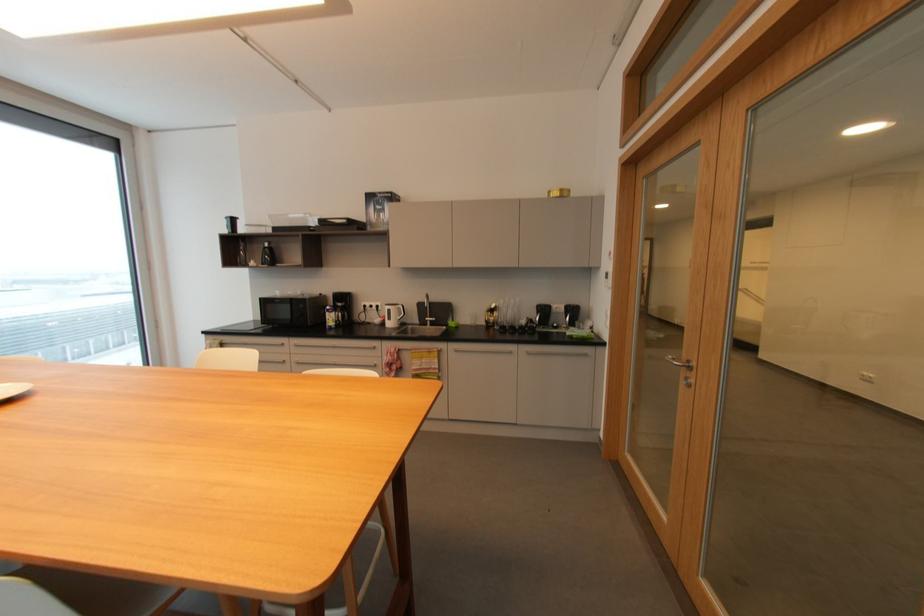
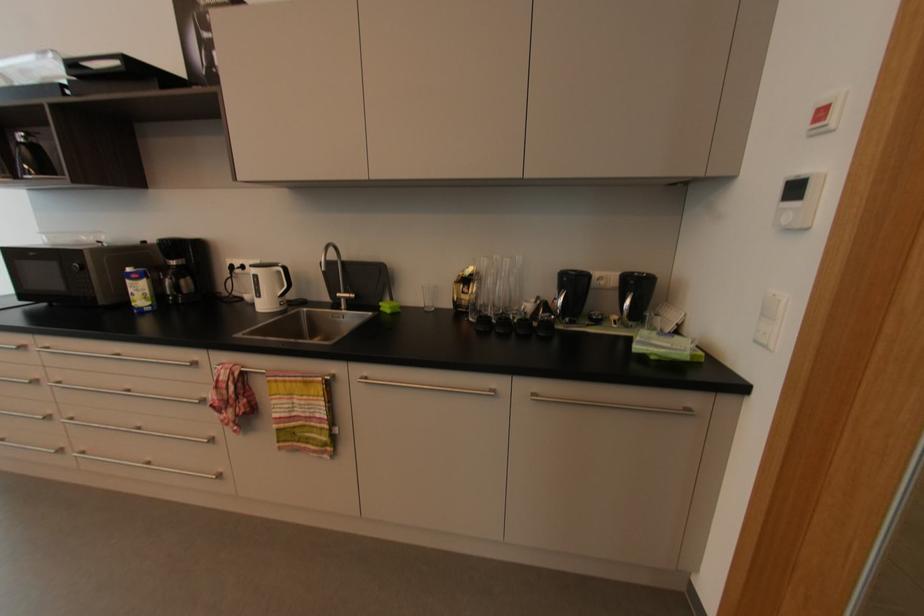
Locate, in the second image, the point that corresponds to (x=403, y=308) in the first image.

(282, 273)